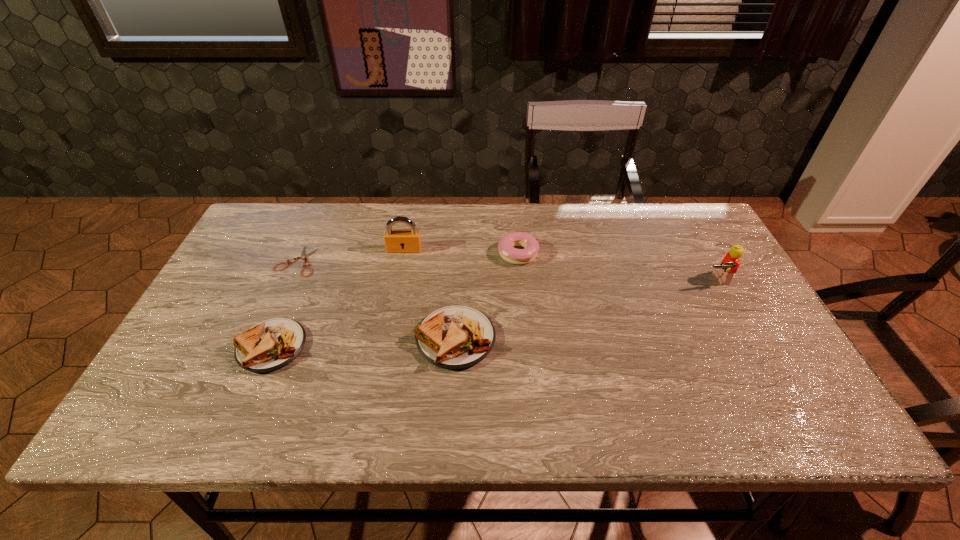
This screenshot has width=960, height=540. Identify the location of object located in the near left corner section of the desktop. (270, 345).

This screenshot has height=540, width=960. In the image, there is a desktop. Identify the location of free space at the far edge. (551, 214).

The height and width of the screenshot is (540, 960). Find the location of `vacant area at the near edge of the desktop`. vacant area at the near edge of the desktop is located at coordinates (357, 372).

Where is `vacant space at the left edge of the desktop`? This screenshot has height=540, width=960. vacant space at the left edge of the desktop is located at coordinates (225, 308).

Identify the location of vacant space at the right edge. (710, 333).

In the image, there is a desktop. At what (x,y) coordinates should I click in order to perform the action: click on vacant space at the far left corner. Please return your answer as a coordinate pair (x, y). The height and width of the screenshot is (540, 960). Looking at the image, I should click on (258, 228).

The image size is (960, 540). Find the location of `vacant space at the near left corner of the desktop`. vacant space at the near left corner of the desktop is located at coordinates (204, 369).

Identify the location of free spot at the far right corner of the desktop. This screenshot has height=540, width=960. (677, 224).

Find the location of `vacant area that lies between the third object from right to left and the third object from left to right`. vacant area that lies between the third object from right to left and the third object from left to right is located at coordinates (430, 294).

The height and width of the screenshot is (540, 960). Identify the location of free point between the padlock and the taller sandwich. (430, 294).